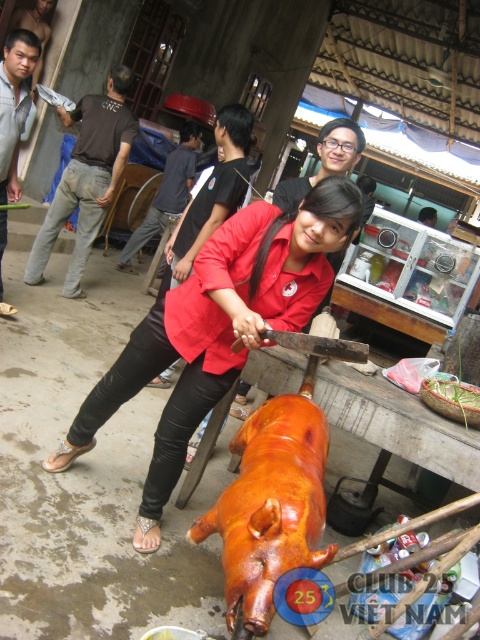
Question: Which object is positioned farthest from the gray fleece jacket at upper left?

Choices:
 (A) brown cotton pants at left
 (B) matte red shirt at center
 (C) smooth brown hair at center
 (D) dark brown leather jacket at center

Answer: (C)

Question: Can you confirm if brown cotton pants at left is wider than dark brown leather jacket at center?

Choices:
 (A) no
 (B) yes

Answer: (B)

Question: Among these points, which one is farthest from the camera?

Choices:
 (A) (168, 186)
 (B) (295, 323)

Answer: (A)

Question: Can you confirm if brown cotton pants at left is positioned to the right of dark brown leather jacket at center?

Choices:
 (A) yes
 (B) no

Answer: (B)

Question: Does golden-brown roasted pig at center have a lesser width compared to dark brown leather jacket at center?

Choices:
 (A) no
 (B) yes

Answer: (B)

Question: Which object appears farthest from the camera in this image?

Choices:
 (A) dark brown leather jacket at center
 (B) gray fleece jacket at upper left
 (C) golden-brown roasted pig at center

Answer: (A)